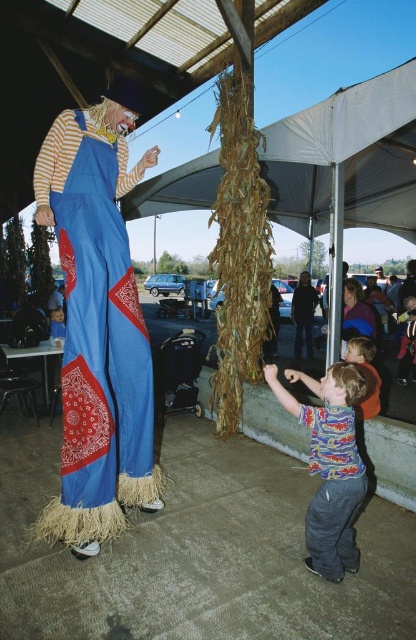
Question: Which object is the farthest from the printed cotton shirt at lower right?

Choices:
 (A) blue straw scarecrow at left
 (B) matte blue shirt at center

Answer: (B)

Question: Does blue straw scarecrow at left appear on the left side of printed cotton shirt at lower right?

Choices:
 (A) yes
 (B) no

Answer: (A)

Question: Estimate the real-world distances between objects in this image. Which object is closer to the matte blue shirt at center?

Choices:
 (A) blue straw scarecrow at left
 (B) printed cotton shirt at lower right

Answer: (B)

Question: Is blue straw scarecrow at left in front of matte blue shirt at center?

Choices:
 (A) no
 (B) yes

Answer: (B)

Question: Which of these objects is positioned closest to the matte blue shirt at center?

Choices:
 (A) blue straw scarecrow at left
 (B) printed cotton shirt at lower right

Answer: (B)

Question: Is blue straw scarecrow at left thinner than matte blue shirt at center?

Choices:
 (A) no
 (B) yes

Answer: (A)